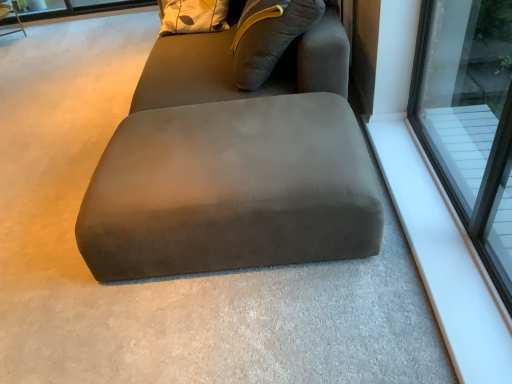
Question: From a real-world perspective, is white smooth window sill at upper right located higher than suede gray bean bag at center?

Choices:
 (A) no
 (B) yes

Answer: (A)

Question: From the image's perspective, is white smooth window sill at upper right above suede gray bean bag at center?

Choices:
 (A) no
 (B) yes

Answer: (A)

Question: Is suede gray bean bag at center at the back of white smooth window sill at upper right?

Choices:
 (A) yes
 (B) no

Answer: (B)

Question: Can you confirm if white smooth window sill at upper right is smaller than suede gray bean bag at center?

Choices:
 (A) yes
 (B) no

Answer: (A)

Question: Does white smooth window sill at upper right come behind suede gray bean bag at center?

Choices:
 (A) no
 (B) yes

Answer: (A)

Question: Is white smooth window sill at upper right wider than suede gray bean bag at center?

Choices:
 (A) no
 (B) yes

Answer: (A)

Question: Considering the relative sizes of suede gray bean bag at center and wooden swivel chair at upper left in the image provided, is suede gray bean bag at center bigger than wooden swivel chair at upper left?

Choices:
 (A) no
 (B) yes

Answer: (B)

Question: Does suede gray bean bag at center have a lesser height compared to wooden swivel chair at upper left?

Choices:
 (A) no
 (B) yes

Answer: (A)

Question: Does suede gray bean bag at center have a lesser width compared to wooden swivel chair at upper left?

Choices:
 (A) yes
 (B) no

Answer: (B)

Question: Is suede gray bean bag at center touching wooden swivel chair at upper left?

Choices:
 (A) no
 (B) yes

Answer: (A)

Question: Does suede gray bean bag at center lie behind wooden swivel chair at upper left?

Choices:
 (A) yes
 (B) no

Answer: (B)

Question: Are suede gray bean bag at center and wooden swivel chair at upper left located far from each other?

Choices:
 (A) yes
 (B) no

Answer: (A)

Question: Is suede ottoman at center taller than transparent glass window at upper right?

Choices:
 (A) no
 (B) yes

Answer: (A)